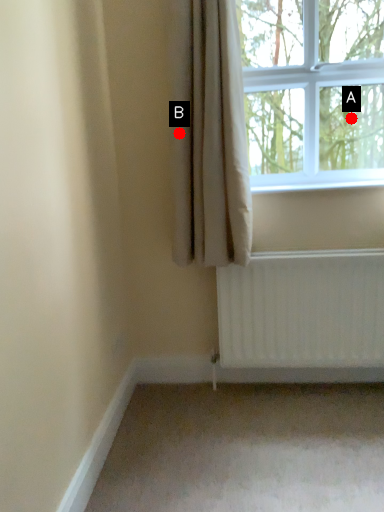
Question: Two points are circled on the image, labeled by A and B beside each circle. Which of the following is the closest to the observer?

Choices:
 (A) A is closer
 (B) B is closer

Answer: (B)